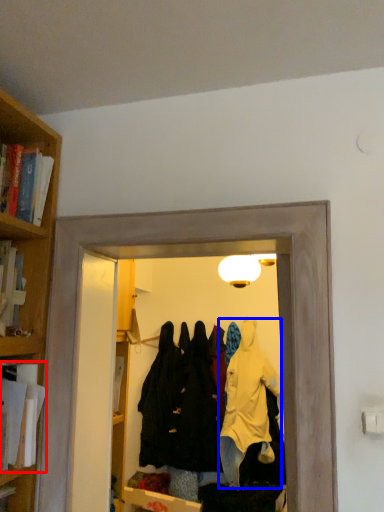
Question: Which object is closer to the camera taking this photo, book (highlighted by a red box) or clothing (highlighted by a blue box)?

Choices:
 (A) book
 (B) clothing

Answer: (A)